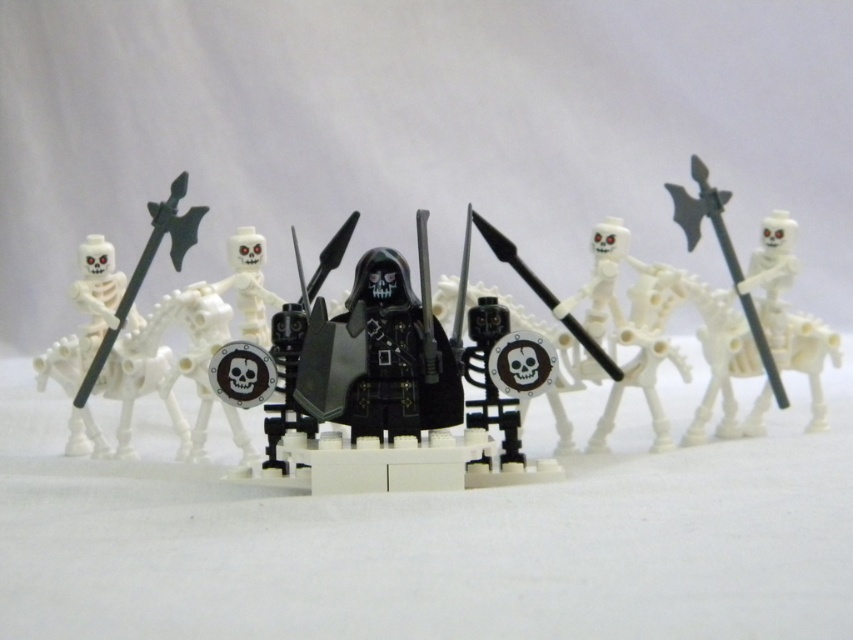
Does black matte armor at center have a larger size compared to black plastic spear at left?

Correct, black matte armor at center is larger in size than black plastic spear at left.

Which is in front, point (262, 477) or point (96, 371)?

Point (262, 477) is more forward.

The width and height of the screenshot is (853, 640). Describe the element at coordinates (363, 465) in the screenshot. I see `black matte armor at center` at that location.

Identify the location of black matte armor at center. (363, 465).

Is black plastic axe at right bigger than smooth white skeleton at center?

Yes.

Who is more forward, [728,259] or [234,248]?

Point [234,248] is in front.

Is point (697, 179) closer to viewer compared to point (259, 236)?

That is False.

Where is `black plastic axe at right`? The height and width of the screenshot is (640, 853). black plastic axe at right is located at coordinates tap(723, 257).

Is black plastic spear at left wider than black plastic spear at center?

In fact, black plastic spear at left might be narrower than black plastic spear at center.

Which is above, black plastic spear at left or black plastic spear at center?

Positioned higher is black plastic spear at left.

The width and height of the screenshot is (853, 640). I want to click on black plastic spear at left, so click(148, 268).

Identify the location of black plastic spear at left. Image resolution: width=853 pixels, height=640 pixels. (148, 268).